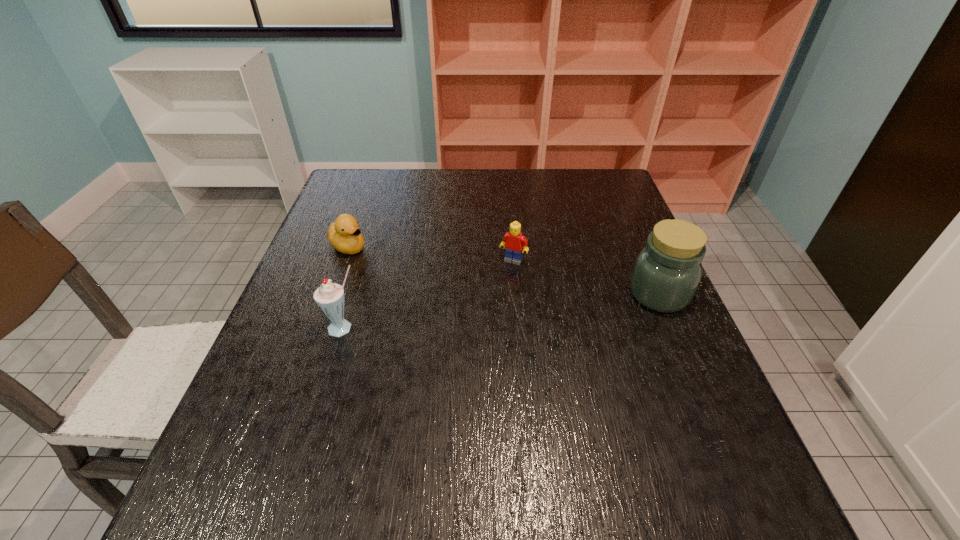
In order to click on free region located on the front-facing side of the second object from right to left in this screenshot , I will do `click(444, 390)`.

The width and height of the screenshot is (960, 540). I want to click on vacant space situated 0.070m on the front-facing side of the second object from right to left, so click(500, 282).

You are a GUI agent. You are given a task and a screenshot of the screen. Output one action in this format:
    pyautogui.click(x=<x>, y=<y>)
    Task: Click on the vacant position located on the front-facing side of the second object from right to left
    The height and width of the screenshot is (540, 960).
    Given the screenshot: What is the action you would take?
    pyautogui.click(x=493, y=296)

Identify the location of milkshake located in the left edge section of the desktop. The width and height of the screenshot is (960, 540). (329, 297).

Where is `duckling that is positioned at the left edge`? The height and width of the screenshot is (540, 960). duckling that is positioned at the left edge is located at coordinates (344, 234).

You are a GUI agent. You are given a task and a screenshot of the screen. Output one action in this format:
    pyautogui.click(x=<x>, y=<y>)
    Task: Click on the object that is at the right edge
    This screenshot has width=960, height=540.
    Given the screenshot: What is the action you would take?
    pyautogui.click(x=667, y=271)

The height and width of the screenshot is (540, 960). I want to click on vacant space at the far edge of the desktop, so click(x=548, y=191).

You are a GUI agent. You are given a task and a screenshot of the screen. Output one action in this format:
    pyautogui.click(x=<x>, y=<y>)
    Task: Click on the vacant area at the near edge
    
    Given the screenshot: What is the action you would take?
    pyautogui.click(x=367, y=453)

In the image, there is a desktop. Where is `vacant space at the left edge`? The height and width of the screenshot is (540, 960). vacant space at the left edge is located at coordinates (354, 270).

The height and width of the screenshot is (540, 960). Identify the location of vacant space at the right edge. (618, 311).